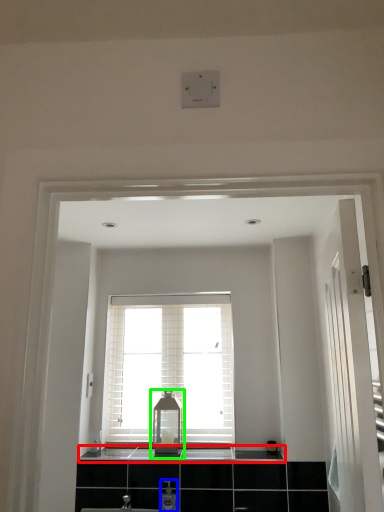
Question: Based on their relative distances, which object is nearer to counter top (highlighted by a red box)? Choose from toiletry (highlighted by a blue box) and medicine cabinet (highlighted by a green box).

Choices:
 (A) toiletry
 (B) medicine cabinet

Answer: (B)